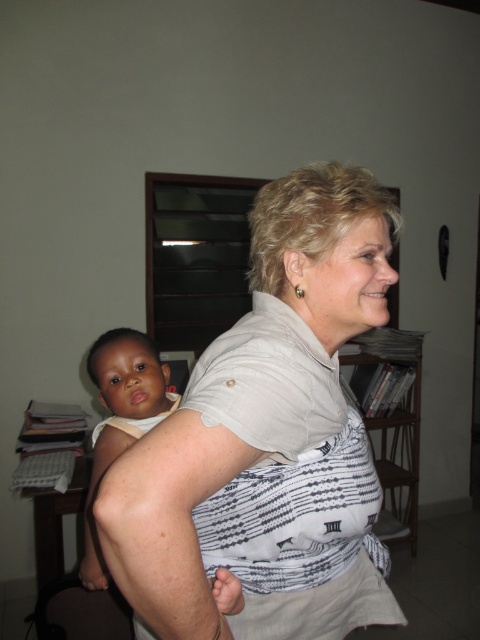
Question: Which point appears closest to the camera in this image?

Choices:
 (A) (292, 173)
 (B) (121, 401)

Answer: (A)

Question: Observing the image, what is the correct spatial positioning of white textured shirt at center in reference to light brown skin baby at center?

Choices:
 (A) left
 (B) right

Answer: (B)

Question: Among these objects, which one is nearest to the camera?

Choices:
 (A) white textured shirt at center
 (B) light brown skin baby at center

Answer: (A)

Question: Considering the relative positions of white textured shirt at center and light brown skin baby at center in the image provided, where is white textured shirt at center located with respect to light brown skin baby at center?

Choices:
 (A) right
 (B) left

Answer: (A)

Question: Which point is closer to the camera?

Choices:
 (A) light brown skin baby at center
 (B) white textured shirt at center

Answer: (B)

Question: Can you confirm if white textured shirt at center is wider than light brown skin baby at center?

Choices:
 (A) yes
 (B) no

Answer: (A)